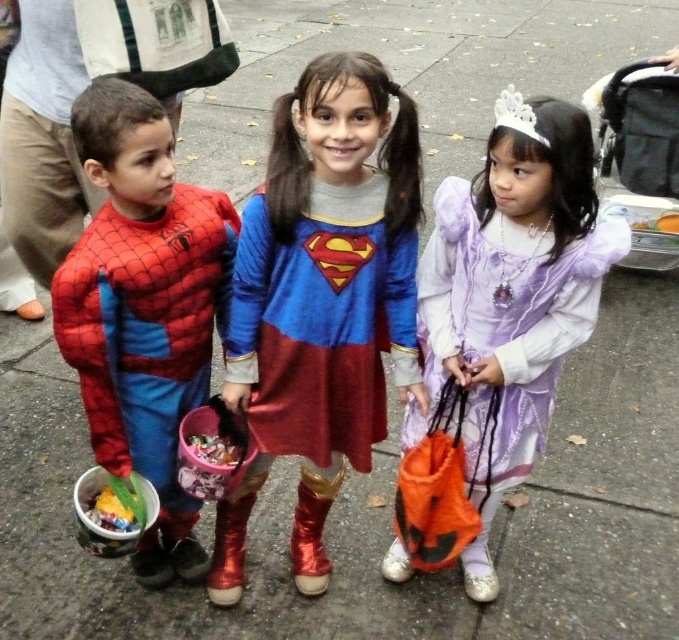
Can you confirm if purple satin dress at center is positioned above black fabric stroller at upper right?

No.

Locate an element on the screen. This screenshot has width=679, height=640. purple satin dress at center is located at coordinates (513, 292).

Who is more distant from viewer, (494, 204) or (73, 285)?

Positioned behind is point (494, 204).

Can you confirm if purple satin dress at center is wider than shiny spandex suit at left?

Yes.

Identify the location of purple satin dress at center. The width and height of the screenshot is (679, 640). (513, 292).

Is shiny blue dress at center further to the viewer compared to purple satin dress at center?

No, shiny blue dress at center is closer to the viewer.

Can you confirm if shiny blue dress at center is thinner than purple satin dress at center?

No.

Measure the distance between point (272, 397) and camera.

Point (272, 397) is 5.33 feet from camera.

You are a GUI agent. You are given a task and a screenshot of the screen. Output one action in this format:
    pyautogui.click(x=<x>, y=<y>)
    Task: Click on the shiny blue dress at center
    The width and height of the screenshot is (679, 640).
    Given the screenshot: What is the action you would take?
    pyautogui.click(x=320, y=300)